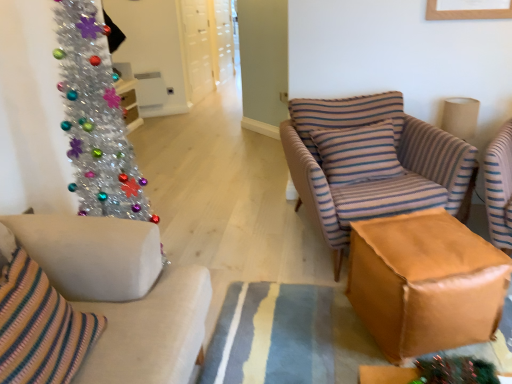
You are a GUI agent. You are given a task and a screenshot of the screen. Output one action in this format:
    pyautogui.click(x=<x>, y=<y>)
    Task: Click on the vacant space in between shiny metallic christmas tree at left and brown leather ottoman at center
    The width and height of the screenshot is (512, 384).
    Given the screenshot: What is the action you would take?
    pyautogui.click(x=281, y=315)